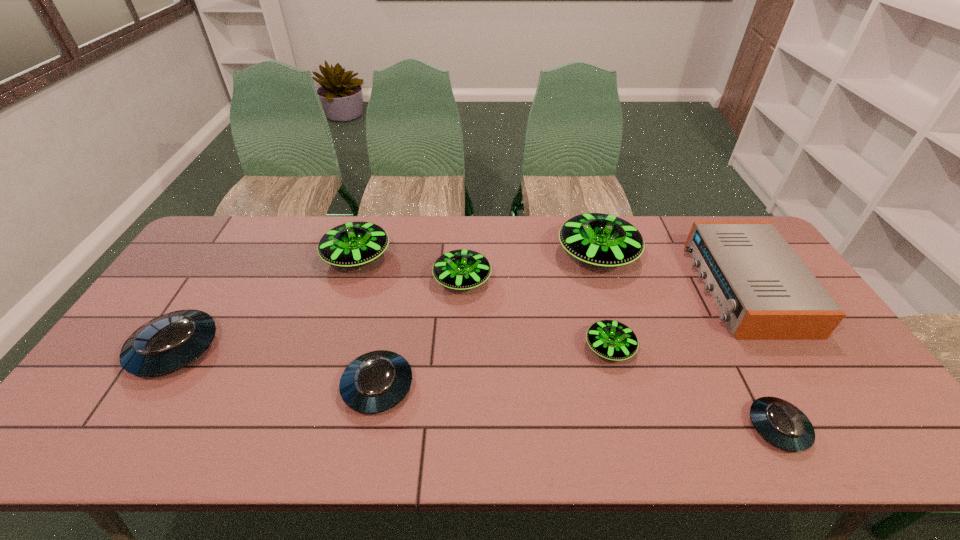
Where is `the fifth closest object to the second biggest gray saucer`? This screenshot has height=540, width=960. the fifth closest object to the second biggest gray saucer is located at coordinates (598, 239).

This screenshot has height=540, width=960. What are the coordinates of `saucer identified as the second closest to the biggest gray saucer` in the screenshot? It's located at (376, 381).

Where is `the sixth closest saucer relative to the smallest green saucer`? This screenshot has width=960, height=540. the sixth closest saucer relative to the smallest green saucer is located at coordinates pyautogui.click(x=169, y=342).

Identify which green saucer is the second nearest to the second gray saucer from right to left. Please provide its 2D coordinates. Your answer should be formatted as a tuple, i.e. [(x, y)], where the tuple contains the x and y coordinates of a point satisfying the conditions above.

[(352, 244)]

Select which green saucer appears as the fourth closest to the radio receiver. Please provide its 2D coordinates. Your answer should be formatted as a tuple, i.e. [(x, y)], where the tuple contains the x and y coordinates of a point satisfying the conditions above.

[(352, 244)]

Locate an element on the screen. The width and height of the screenshot is (960, 540). the second closest gray saucer relative to the second gray saucer from left to right is located at coordinates (781, 423).

The height and width of the screenshot is (540, 960). What are the coordinates of `gray saucer that is the closest to the leftmost green saucer` in the screenshot? It's located at (169, 342).

Locate an element on the screen. The height and width of the screenshot is (540, 960). vacant area in the image that satisfies the following two spatial constraints: 1. on the back side of the leftmost gray saucer; 2. on the left side of the tallest object is located at coordinates (234, 255).

This screenshot has height=540, width=960. Find the location of `vacant space that satisfies the following two spatial constraints: 1. on the front side of the second smallest gray saucer; 2. on the right side of the rightmost gray saucer`. vacant space that satisfies the following two spatial constraints: 1. on the front side of the second smallest gray saucer; 2. on the right side of the rightmost gray saucer is located at coordinates (370, 427).

Find the location of a particular element. Image resolution: width=960 pixels, height=540 pixels. vacant region that satisfies the following two spatial constraints: 1. on the back side of the nearest green saucer; 2. on the right side of the second gray saucer from right to left is located at coordinates (385, 348).